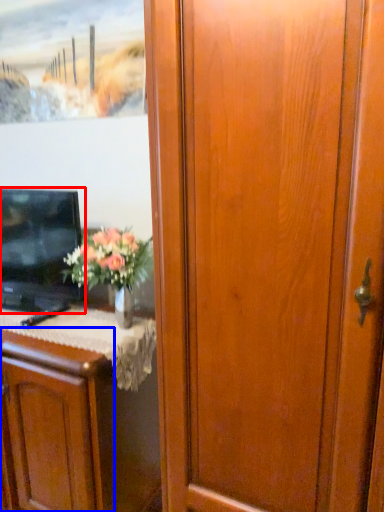
Question: Which of the following is the closest to the observer, television (highlighted by a red box) or cabinetry (highlighted by a blue box)?

Choices:
 (A) television
 (B) cabinetry

Answer: (B)